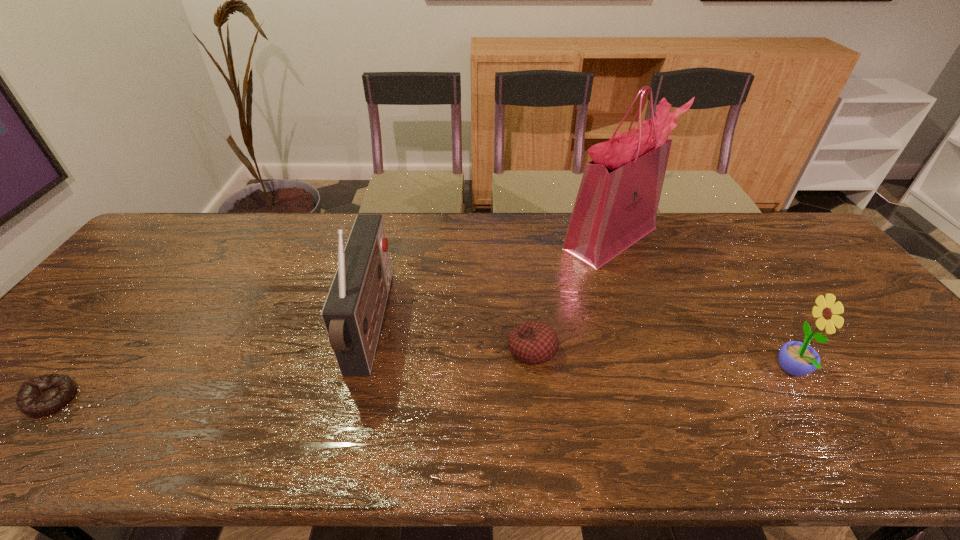
Image resolution: width=960 pixels, height=540 pixels. I want to click on shopping bag, so point(617,202).

Find the location of a particular element. The image size is (960, 540). the farthest object is located at coordinates (617, 202).

The height and width of the screenshot is (540, 960). What are the coordinates of `radio receiver` in the screenshot? It's located at (353, 311).

Where is `the second tallest object`? This screenshot has height=540, width=960. the second tallest object is located at coordinates (353, 311).

The width and height of the screenshot is (960, 540). I want to click on the third shortest object, so click(x=796, y=358).

The image size is (960, 540). What are the coordinates of `sunflower` in the screenshot? It's located at (796, 358).

Locate an element on the screen. This screenshot has width=960, height=540. the second shortest object is located at coordinates (534, 342).

The width and height of the screenshot is (960, 540). In order to click on the right beanbag in this screenshot , I will do `click(534, 342)`.

Identify the location of the shortest object. The image size is (960, 540). (41, 396).

Identify the location of the shorter beanbag. This screenshot has width=960, height=540. (41, 396).